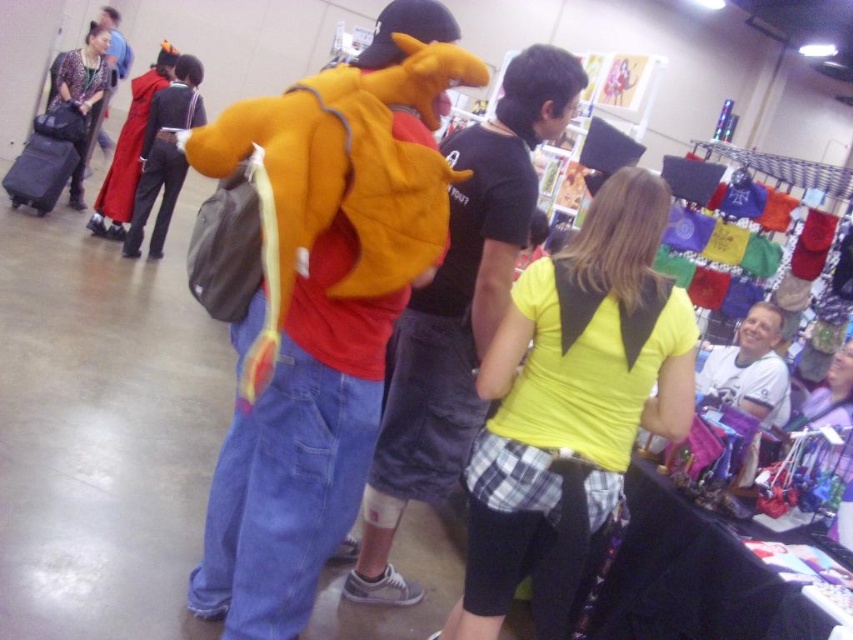
Question: Among these objects, which one is nearest to the camera?

Choices:
 (A) red fabric cape at upper left
 (B) velvet red cape at upper left

Answer: (B)

Question: Is the position of velvet red cape at upper left less distant than that of patterned fabric jacket at upper left?

Choices:
 (A) no
 (B) yes

Answer: (B)

Question: Which point is farther from the camera taking this photo?

Choices:
 (A) (590, 392)
 (B) (148, 205)

Answer: (B)

Question: Does yellow matte shirt at center have a lesser width compared to patterned fabric jacket at upper left?

Choices:
 (A) no
 (B) yes

Answer: (A)

Question: Can you confirm if velvet red cape at upper left is thinner than red fabric cape at upper left?

Choices:
 (A) yes
 (B) no

Answer: (A)

Question: Estimate the real-world distances between objects in this image. Which object is closer to the red fabric cape at upper left?

Choices:
 (A) yellow fleece backpack at center
 (B) yellow matte shirt at center
 (C) patterned fabric jacket at upper left

Answer: (C)